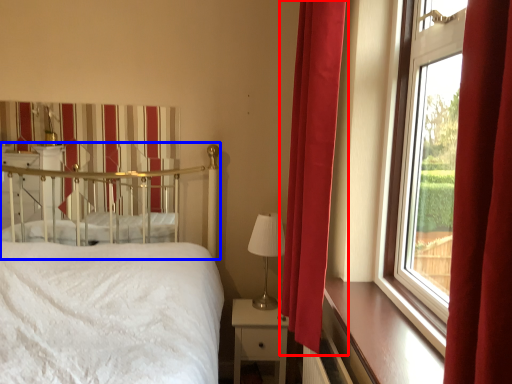
Question: Which object appears closest to the camera in this image, curtain (highlighted by a red box) or canopy bed (highlighted by a blue box)?

Choices:
 (A) curtain
 (B) canopy bed

Answer: (A)